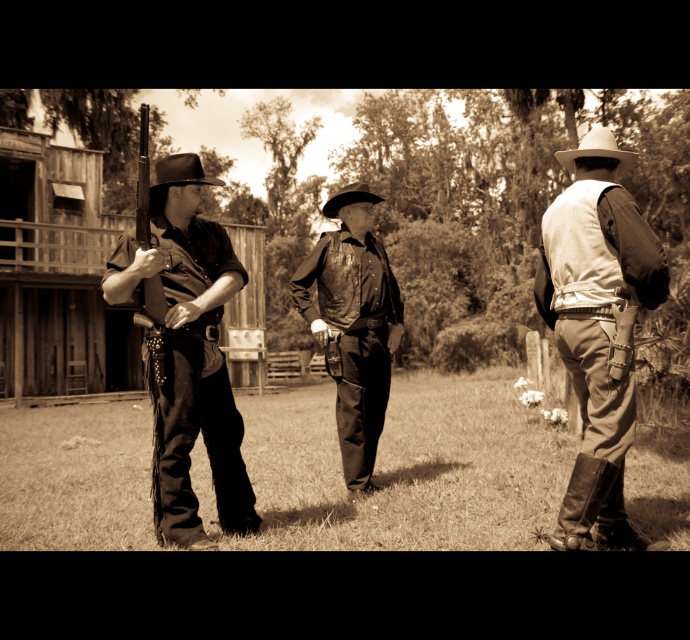
You are a photographer setting up a shoot with the scene described. You need to ensure that the matte black rifle at left and the white matte cowboy hat at upper right are both visible in your photo. Given their relative sizes, which object should you position closer to the camera to maintain their visibility?

The matte black rifle at left is much taller than the white matte cowboy hat at upper right. To ensure both are visible, position the shorter white matte cowboy hat at upper right closer to the camera so its size in the frame matches the taller rifle.

In the vintage Old West scene, there are a matte black rifle at left and a black felt cowboy hat at center. Which object takes up more space in the image?

The black felt cowboy hat at center takes up more space than the matte black rifle at left.

Based on the scene description, which object takes up more space in the image between the matte black rifle at left and the white matte cowboy hat at upper right?

The white matte cowboy hat at upper right takes up more space in the image than the matte black rifle at left according to the description.